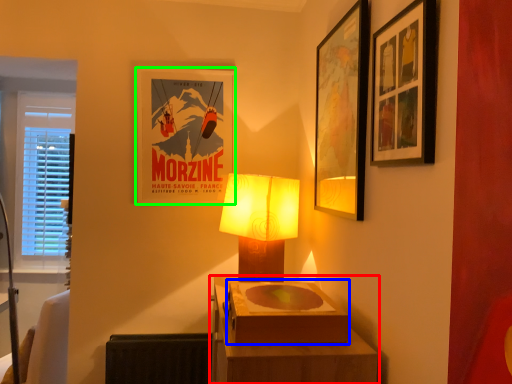
Question: Estimate the real-world distances between objects in this image. Which object is closer to table (highlighted by a red box), box (highlighted by a blue box) or picture frame (highlighted by a green box)?

Choices:
 (A) box
 (B) picture frame

Answer: (A)